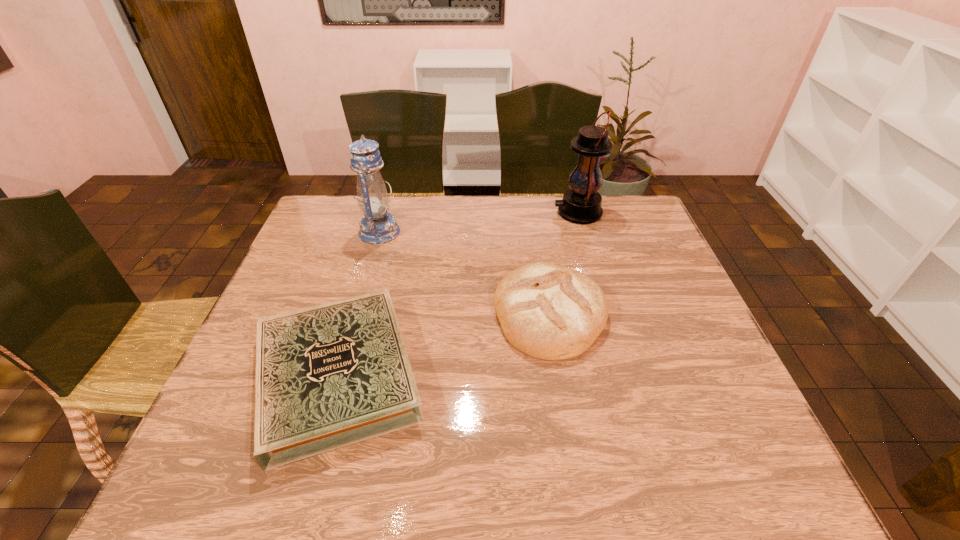
I want to click on the right lantern, so click(581, 204).

Locate an element on the screen. The image size is (960, 540). the left lantern is located at coordinates (377, 226).

The width and height of the screenshot is (960, 540). In order to click on the third tallest object in this screenshot , I will do `click(550, 312)`.

I want to click on the shortest object, so click(x=331, y=375).

Locate the blank area located 0.270m above the right lantern, indicating its light source in the image. Please provide its 2D coordinates. Your answer should be formatted as a tuple, i.e. [(x, y)], where the tuple contains the x and y coordinates of a point satisfying the conditions above.

[(474, 212)]

Locate the blank area located above the right lantern, indicating its light source in the image. Please provide its 2D coordinates. Your answer should be formatted as a tuple, i.e. [(x, y)], where the tuple contains the x and y coordinates of a point satisfying the conditions above.

[(442, 212)]

Locate any vacant position located above the right lantern, indicating its light source in the image. Please provide its 2D coordinates. Your answer should be formatted as a tuple, i.e. [(x, y)], where the tuple contains the x and y coordinates of a point satisfying the conditions above.

[(444, 212)]

Image resolution: width=960 pixels, height=540 pixels. What are the coordinates of `vacant space located 0.060m on the front-facing side of the left lantern` in the screenshot? It's located at (419, 232).

Image resolution: width=960 pixels, height=540 pixels. I want to click on free region located 0.400m on the left of the bread, so click(x=340, y=314).

You are a GUI agent. You are given a task and a screenshot of the screen. Output one action in this format:
    pyautogui.click(x=<x>, y=<y>)
    Task: Click on the vacant position located 0.390m on the right of the shortest object
    
    Given the screenshot: What is the action you would take?
    pyautogui.click(x=601, y=375)